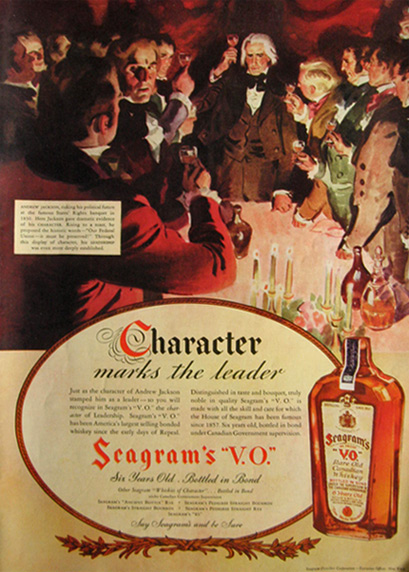
This screenshot has width=409, height=572. Find the location of `decorative brown border`. decorative brown border is located at coordinates (202, 545), (187, 300).